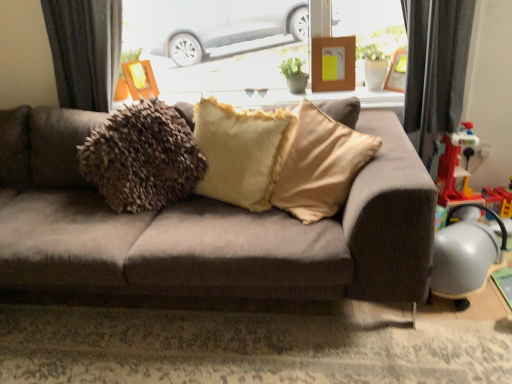
Question: Is there a large distance between suede-like brown couch at center and white glossy window sill at upper center?

Choices:
 (A) yes
 (B) no

Answer: (B)

Question: Is suede-like brown couch at center outside white glossy window sill at upper center?

Choices:
 (A) no
 (B) yes

Answer: (B)

Question: From a real-world perspective, is suede-like brown couch at center positioned over white glossy window sill at upper center based on gravity?

Choices:
 (A) yes
 (B) no

Answer: (B)

Question: Can you confirm if suede-like brown couch at center is taller than white glossy window sill at upper center?

Choices:
 (A) no
 (B) yes

Answer: (B)

Question: Can you confirm if suede-like brown couch at center is wider than white glossy window sill at upper center?

Choices:
 (A) yes
 (B) no

Answer: (A)

Question: Would you say wooden frame at upper center, the 3th picture frame viewed from the right, is inside or outside suede-like brown couch at center?

Choices:
 (A) inside
 (B) outside

Answer: (B)

Question: From a real-world perspective, is wooden frame at upper center, the 3th picture frame viewed from the right, positioned above or below suede-like brown couch at center?

Choices:
 (A) above
 (B) below

Answer: (A)

Question: In terms of height, does wooden frame at upper center, which is counted as the 1th picture frame, starting from the left, look taller or shorter compared to suede-like brown couch at center?

Choices:
 (A) tall
 (B) short

Answer: (B)

Question: Is point (142, 96) closer or farther from the camera than point (415, 200)?

Choices:
 (A) closer
 (B) farther

Answer: (B)

Question: Considering the positions of wooden frame at upper right, positioned as the third picture frame in left-to-right order, and wooden frame at upper center, which is counted as the 1th picture frame, starting from the left, in the image, is wooden frame at upper right, positioned as the third picture frame in left-to-right order, wider or thinner than wooden frame at upper center, which is counted as the 1th picture frame, starting from the left,?

Choices:
 (A) thin
 (B) wide

Answer: (A)

Question: From a real-world perspective, is wooden frame at upper right, arranged as the 1th picture frame when viewed from the right, above or below wooden frame at upper center, which is counted as the 1th picture frame, starting from the left?

Choices:
 (A) below
 (B) above

Answer: (A)

Question: Looking at the image, does wooden frame at upper right, positioned as the third picture frame in left-to-right order, seem bigger or smaller compared to wooden frame at upper center, which is counted as the 1th picture frame, starting from the left?

Choices:
 (A) small
 (B) big

Answer: (A)

Question: Do you think wooden frame at upper right, positioned as the third picture frame in left-to-right order, is within wooden frame at upper center, the 3th picture frame viewed from the right, or outside of it?

Choices:
 (A) outside
 (B) inside

Answer: (A)

Question: From their relative heights in the image, would you say wooden frame at upper center, the 3th picture frame viewed from the right, is taller or shorter than metallic gray armchair at lower right?

Choices:
 (A) tall
 (B) short

Answer: (B)

Question: From a real-world perspective, is wooden frame at upper center, the 3th picture frame viewed from the right, positioned above or below metallic gray armchair at lower right?

Choices:
 (A) above
 (B) below

Answer: (A)